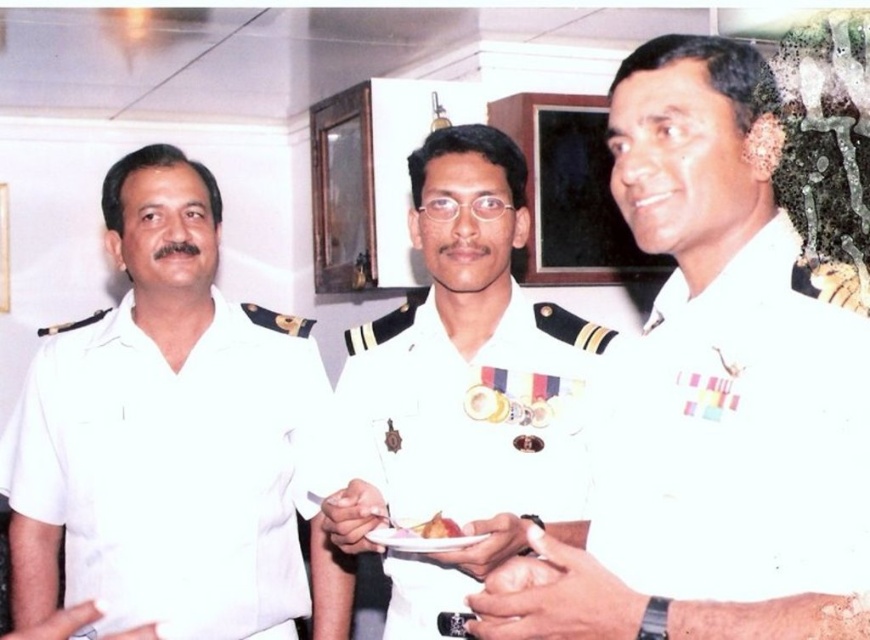
Who is positioned more to the right, white glossy uniform at center or smooth brown cake at center?

white glossy uniform at center is more to the right.

Can you confirm if white glossy uniform at center is smaller than smooth brown cake at center?

No, white glossy uniform at center is not smaller than smooth brown cake at center.

Find the location of `white glossy uniform at center`. white glossy uniform at center is located at coordinates (472, 412).

This screenshot has width=870, height=640. Find the location of `white glossy uniform at center`. white glossy uniform at center is located at coordinates (472, 412).

Between white cotton shirt at right and smooth brown cake at center, which one has less height?

With less height is smooth brown cake at center.

You are a GUI agent. You are given a task and a screenshot of the screen. Output one action in this format:
    pyautogui.click(x=<x>, y=<y>)
    Task: Click on the white cotton shirt at right
    The width and height of the screenshot is (870, 640).
    Given the screenshot: What is the action you would take?
    pyautogui.click(x=737, y=438)

Who is more forward, (445,588) or (385,531)?

Point (385,531) is in front.

Does point (497, 460) lie behind point (405, 550)?

Yes, point (497, 460) is behind point (405, 550).

At what (x,y) coordinates should I click in order to perform the action: click on white glossy uniform at center. Please return your answer as a coordinate pair (x, y). Looking at the image, I should click on (472, 412).